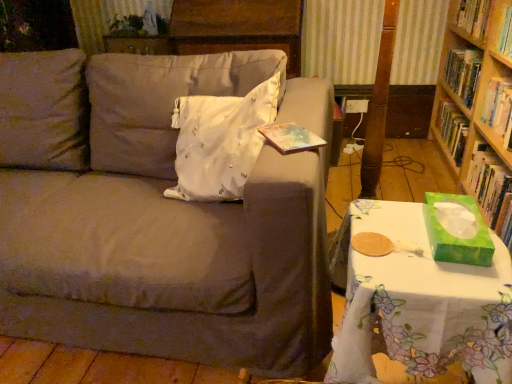
What are the coordinates of `empty space that is ontop of white floral tablecloth at lower right (from a real-world perspective)` in the screenshot? It's located at (406, 243).